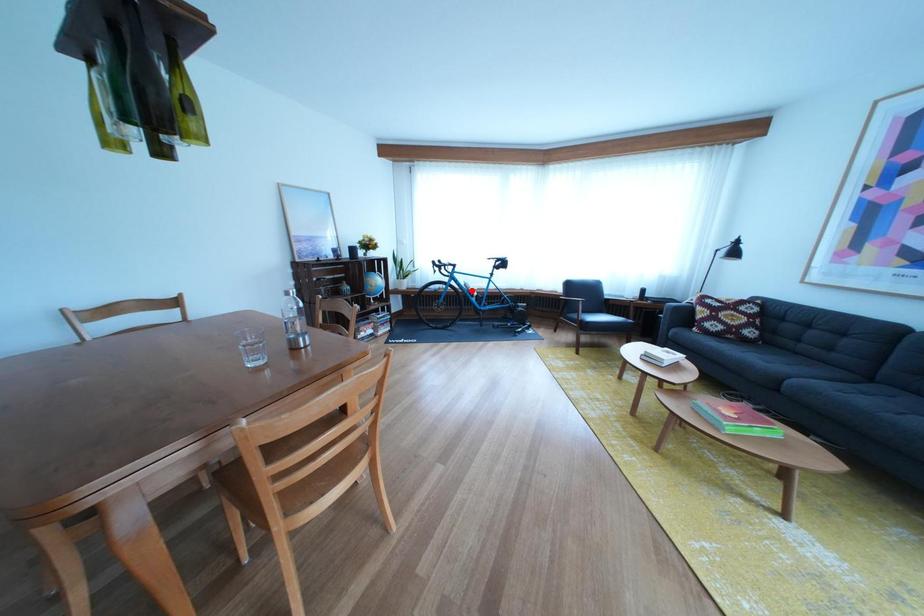
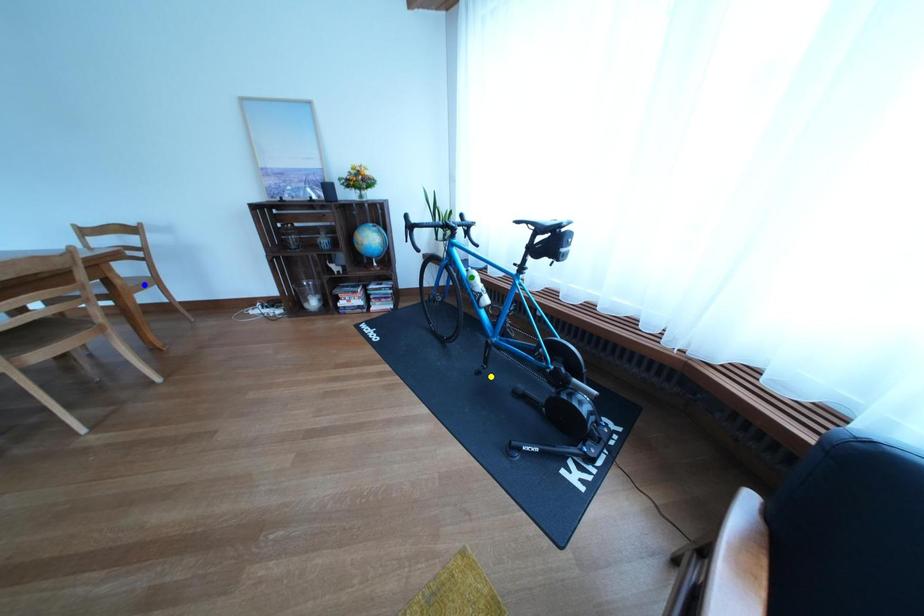
Question: I am providing you with two images of the same scene from different viewpoints. A red point is marked on the first image. You are given multiple points on the second image. Which point in image 2 is actually the same real-world point as the red point in image 1?

Choices:
 (A) green point
 (B) yellow point
 (C) blue point

Answer: (A)